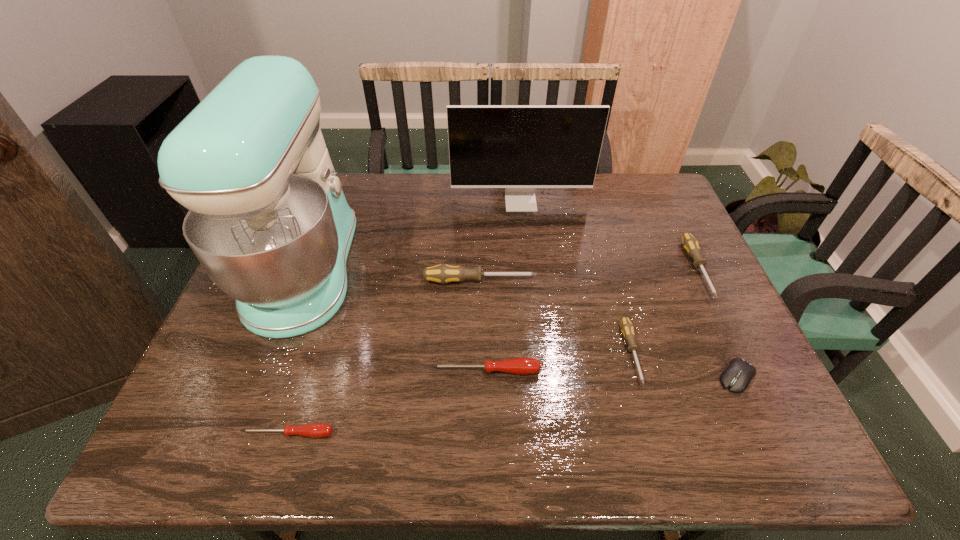
Locate an element on the screen. free space between the rightmost screwdriver and the sixth shortest object is located at coordinates (588, 275).

This screenshot has height=540, width=960. Identify the location of free space between the rightmost screwdriver and the monitor. (609, 235).

I want to click on empty space between the second smallest gray screwdriver and the right red screwdriver, so click(591, 320).

Identify the location of free space between the nearest screwdriver and the second gray screwdriver from left to right. (460, 393).

This screenshot has height=540, width=960. I want to click on free spot between the tallest object and the rightmost gray screwdriver, so click(x=501, y=269).

Image resolution: width=960 pixels, height=540 pixels. I want to click on free spot between the right red screwdriver and the leftmost gray screwdriver, so 483,326.

I want to click on the sixth closest object to the seventh shortest object, so click(737, 376).

You are a GUI agent. You are given a task and a screenshot of the screen. Output one action in this format:
    pyautogui.click(x=<x>, y=<y>)
    Task: Click on the second closest object to the mixer
    
    Given the screenshot: What is the action you would take?
    pyautogui.click(x=315, y=430)

Identify which screwdriver is the fourth closest to the tallest screwdriver. Please provide its 2D coordinates. Your answer should be formatted as a tuple, i.e. [(x, y)], where the tuple contains the x and y coordinates of a point satisfying the conditions above.

[(690, 244)]

Where is `screwdriver that is the closest one to the nearer red screwdriver`? screwdriver that is the closest one to the nearer red screwdriver is located at coordinates (523, 366).